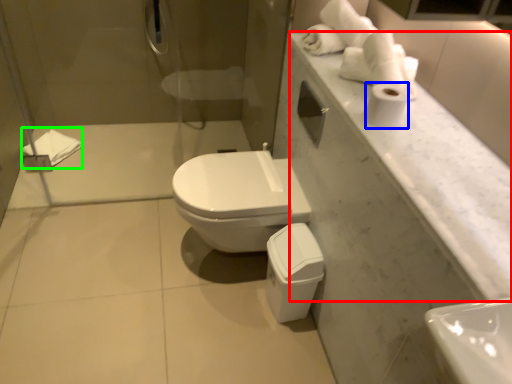
Question: Which is farther away from counter top (highlighted by a red box)? toilet paper (highlighted by a blue box) or bath towel (highlighted by a green box)?

Choices:
 (A) toilet paper
 (B) bath towel

Answer: (B)